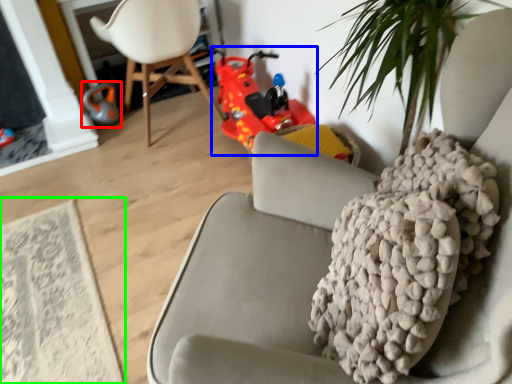
Question: Estimate the real-world distances between objects in this image. Which object is farther from toy (highlighted by a red box), toy car (highlighted by a blue box) or mat (highlighted by a green box)?

Choices:
 (A) toy car
 (B) mat

Answer: (B)